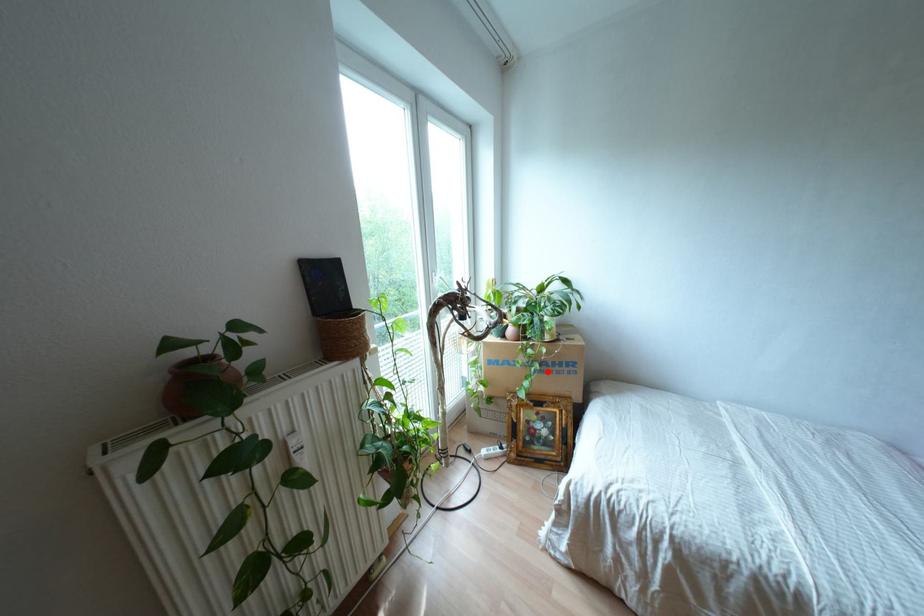
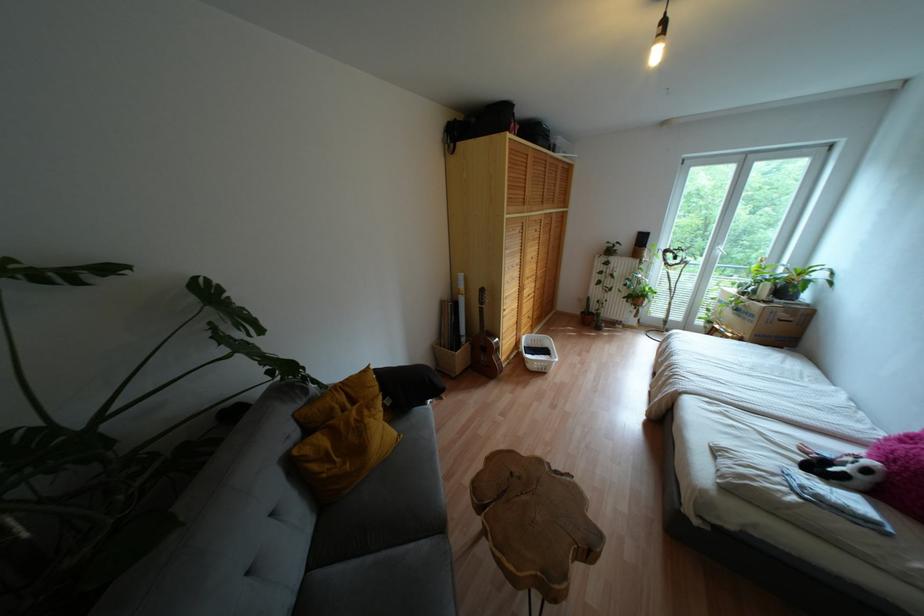
The point at the highlighted location is marked in the first image. Where is the corresponding point in the second image?

(737, 315)